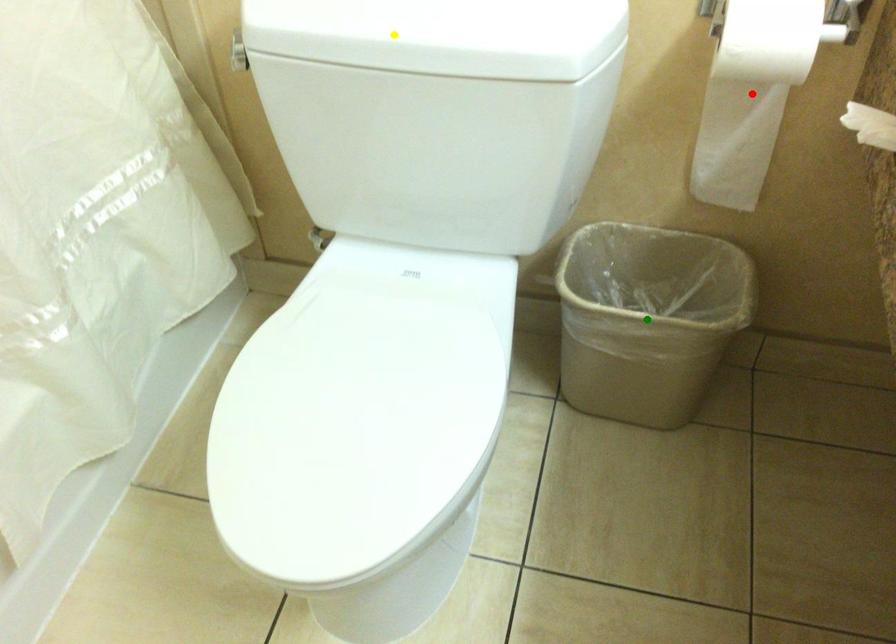
Order these from nearest to farthest:
yellow point, green point, red point

yellow point, red point, green point